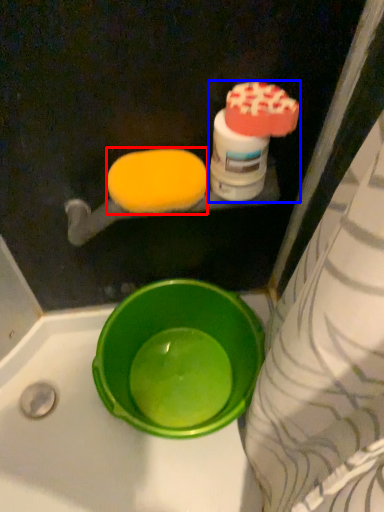
Question: Which object appears closest to the camera in this image, food (highlighted by a red box) or cleaning product (highlighted by a blue box)?

Choices:
 (A) food
 (B) cleaning product

Answer: (B)